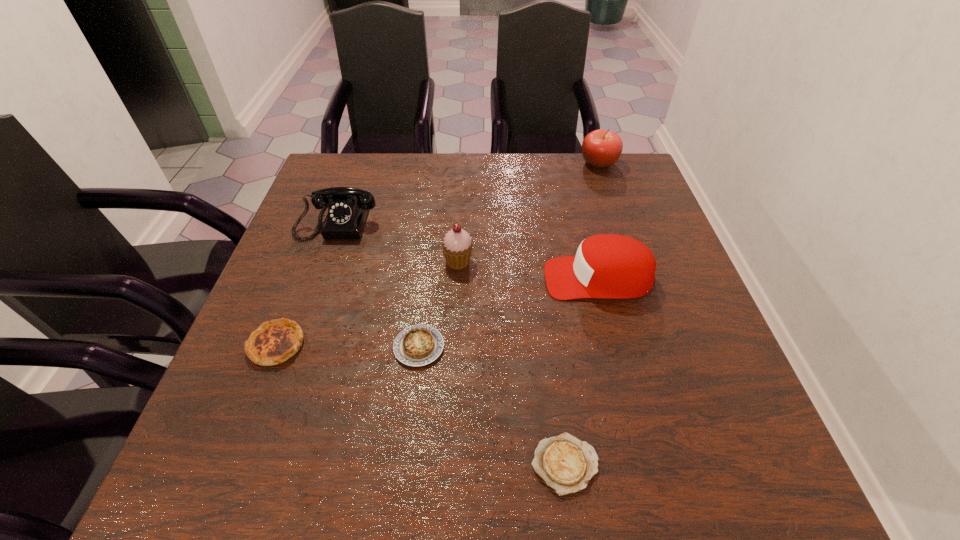
Find the location of a particular element. The height and width of the screenshot is (540, 960). vacant region that satisfies the following two spatial constraints: 1. on the front side of the tallest quiche; 2. on the right side of the shortest object is located at coordinates (230, 464).